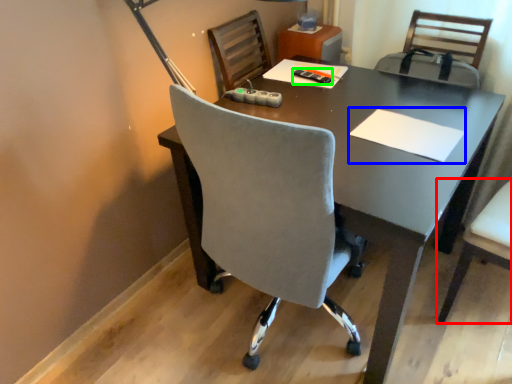
Question: Which object is positioned closest to chair (highlighted by a red box)? Select from notepad (highlighted by a blue box) and stationery (highlighted by a green box).

Choices:
 (A) notepad
 (B) stationery

Answer: (A)